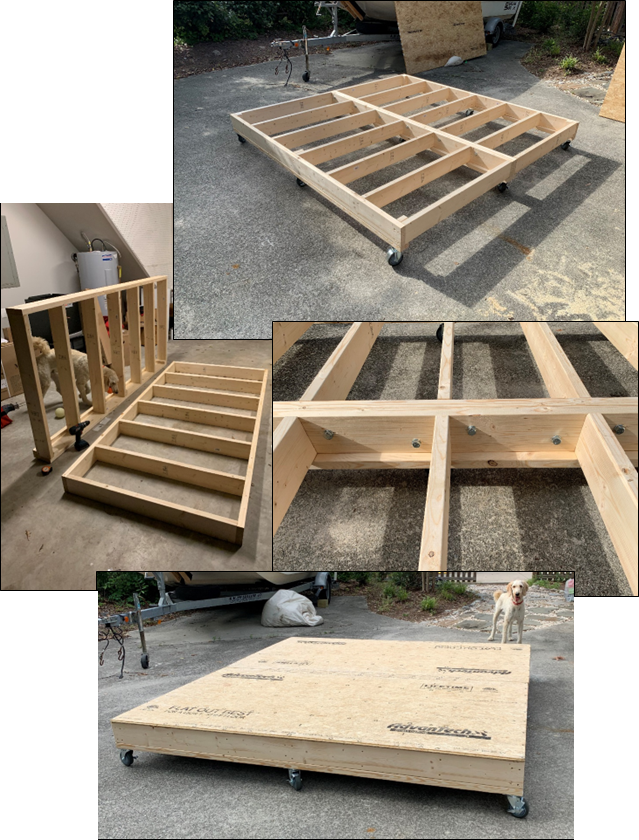
I want to click on trash bag, so click(x=289, y=599).